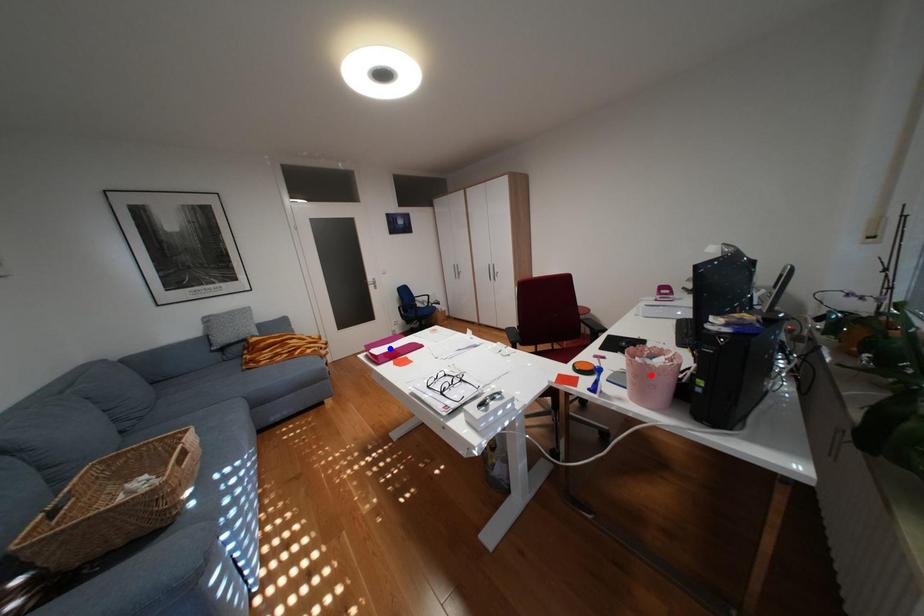
Question: Which of the two points in the image is closer to the camera?

Choices:
 (A) Blue point is closer.
 (B) Red point is closer.

Answer: (B)